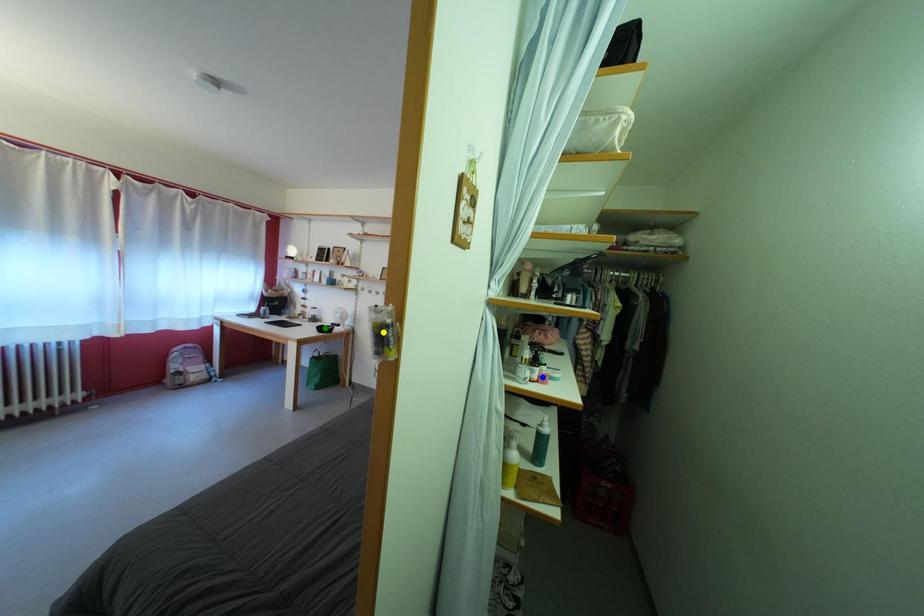
Order these from nearest to farthest:
yellow point, green point, blue point

yellow point → blue point → green point